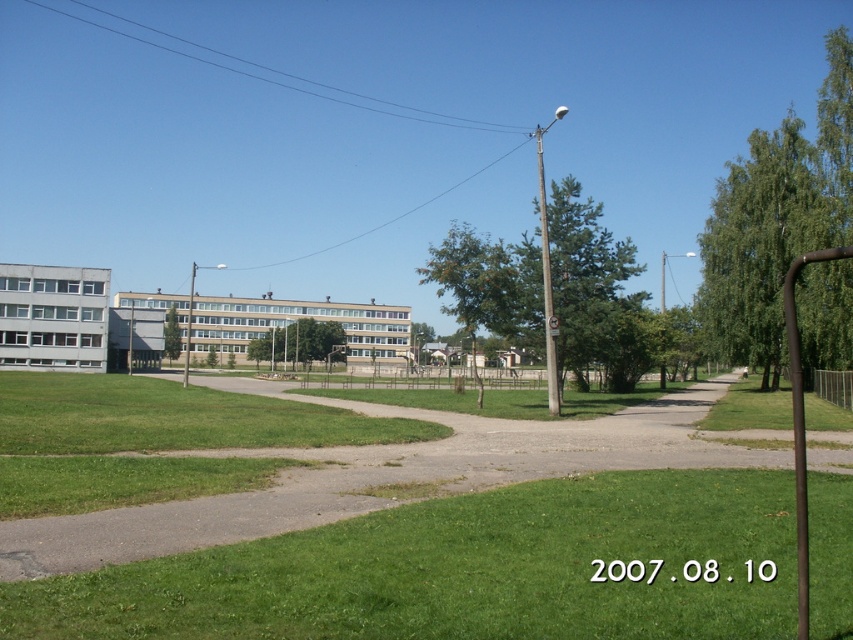
Is point (636, 500) behind point (349, 472)?

No, (636, 500) is closer to viewer.

Does point (672, 512) come behind point (48, 536)?

Yes, it is behind point (48, 536).

Identify the location of green grass at lower left. (x=463, y=570).

Who is more distant from viewer, [479,496] or [219,268]?

The point [219,268] is behind.

Which is in front, point (263, 634) or point (189, 340)?

Point (263, 634) is in front.

Image resolution: width=853 pixels, height=640 pixels. Identify the location of green grass at lower left. (463, 570).

Between green grass at lower left and brown wooden pole at right, which one appears on the left side from the viewer's perspective?

green grass at lower left is more to the left.

What do you see at coordinates (463, 570) in the screenshot?
I see `green grass at lower left` at bounding box center [463, 570].

At what (x,y) coordinates should I click in order to perform the action: click on green grass at lower left. Please return your answer as a coordinate pair (x, y). The image size is (853, 640). Looking at the image, I should click on (463, 570).